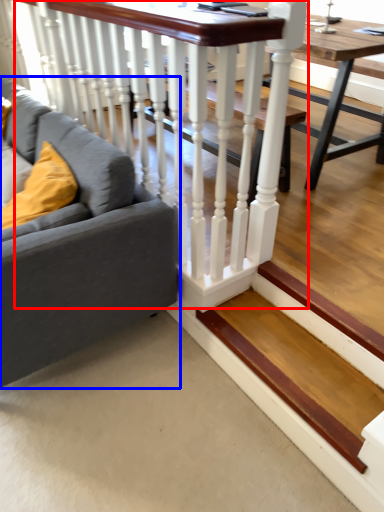
Question: Which point is further to the camera, rail (highlighted by a red box) or studio couch (highlighted by a blue box)?

Choices:
 (A) rail
 (B) studio couch

Answer: (A)